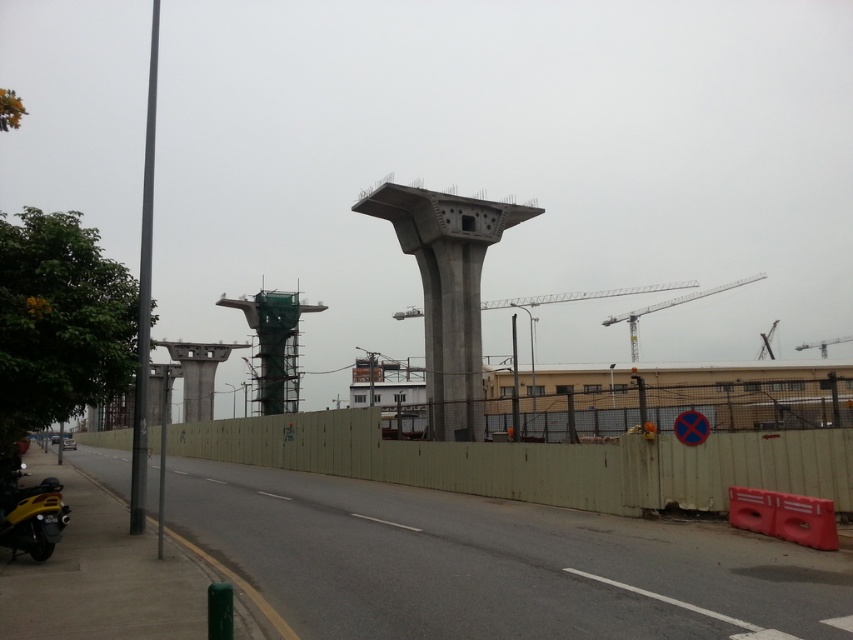
Question: Which point is closer to the camera?

Choices:
 (A) yellow matte motorcycle at lower left
 (B) white metallic crane at upper center
 (C) green concrete control tower at center
 (D) metallic gray crane at upper right

Answer: (A)

Question: Estimate the real-world distances between objects in this image. Which object is closer to the concrete at center?

Choices:
 (A) yellow matte motorcycle at lower left
 (B) green concrete fence at center
 (C) green concrete control tower at center

Answer: (B)

Question: Observing the image, what is the correct spatial positioning of green concrete control tower at center in reference to white metallic crane at upper center?

Choices:
 (A) right
 (B) left

Answer: (B)

Question: Which object is positioned closest to the metallic gray crane at upper right?

Choices:
 (A) green concrete control tower at center
 (B) concrete at center

Answer: (A)

Question: Can you confirm if yellow matte motorcycle at lower left is positioned to the left of white metallic crane at upper center?

Choices:
 (A) yes
 (B) no

Answer: (A)

Question: Is green concrete control tower at center wider than metallic gray crane at upper right?

Choices:
 (A) no
 (B) yes

Answer: (A)